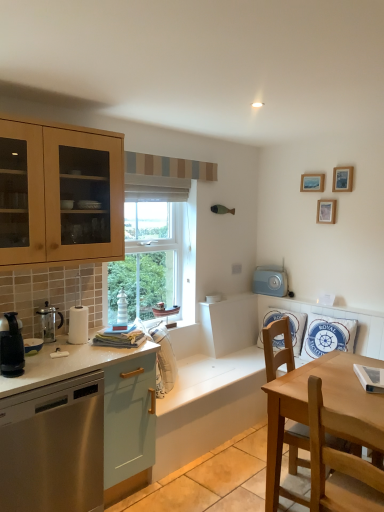
Question: Should I look upward or downward to see black plastic coffee maker at left, the 1th kitchen appliance from the front?

Choices:
 (A) up
 (B) down

Answer: (B)

Question: Which direction should I rotate to face white striped lighthouse at window, which is the third appliance in right-to-left order, — up or down?

Choices:
 (A) up
 (B) down

Answer: (B)

Question: Is wooden picture frame at upper right, the second picture frame ordered from the bottom, oriented towards white striped lighthouse at window, the second appliance when ordered from front to back?

Choices:
 (A) yes
 (B) no

Answer: (B)

Question: Can you confirm if wooden picture frame at upper right, the second picture frame ordered from the bottom, is thinner than white striped lighthouse at window, the second appliance when ordered from front to back?

Choices:
 (A) no
 (B) yes

Answer: (B)

Question: Is wooden picture frame at upper right, the second picture frame ordered from the bottom, to the right of white striped lighthouse at window, which is the third appliance in right-to-left order, from the viewer's perspective?

Choices:
 (A) yes
 (B) no

Answer: (A)

Question: From a real-world perspective, does wooden picture frame at upper right, placed as the 2th picture frame when sorted from top to bottom, sit lower than white striped lighthouse at window, which is the third appliance in right-to-left order?

Choices:
 (A) yes
 (B) no

Answer: (B)

Question: Is white striped lighthouse at window, which is counted as the 1th appliance, starting from the left, completely or partially inside wooden picture frame at upper right, placed as the 2th picture frame when sorted from top to bottom?

Choices:
 (A) yes
 (B) no

Answer: (B)

Question: Is wooden picture frame at upper right, placed as the 2th picture frame when sorted from top to bottom, with white striped lighthouse at window, the second appliance when ordered from front to back?

Choices:
 (A) yes
 (B) no

Answer: (B)

Question: Does white fabric pillow at right, acting as the second pillow starting from the right, contain transparent glass coffee maker at left, positioned as the 2th kitchen appliance in front-to-back order?

Choices:
 (A) no
 (B) yes

Answer: (A)

Question: Can you confirm if white fabric pillow at right, acting as the second pillow starting from the right, is positioned to the right of transparent glass coffee maker at left, arranged as the first kitchen appliance when viewed from the back?

Choices:
 (A) no
 (B) yes

Answer: (B)

Question: Can you confirm if white fabric pillow at right, acting as the second pillow starting from the right, is smaller than transparent glass coffee maker at left, arranged as the first kitchen appliance when viewed from the back?

Choices:
 (A) yes
 (B) no

Answer: (B)

Question: Considering the relative sizes of white fabric pillow at right, acting as the second pillow starting from the right, and transparent glass coffee maker at left, positioned as the 2th kitchen appliance in front-to-back order, in the image provided, is white fabric pillow at right, acting as the second pillow starting from the right, taller than transparent glass coffee maker at left, positioned as the 2th kitchen appliance in front-to-back order,?

Choices:
 (A) yes
 (B) no

Answer: (A)

Question: From the image's perspective, is white fabric pillow at right, which ranks as the 1th pillow in left-to-right order, located beneath transparent glass coffee maker at left, arranged as the first kitchen appliance when viewed from the back?

Choices:
 (A) no
 (B) yes

Answer: (B)

Question: Is white fabric pillow at right, acting as the second pillow starting from the right, oriented away from transparent glass coffee maker at left, positioned as the 2th kitchen appliance in front-to-back order?

Choices:
 (A) no
 (B) yes

Answer: (A)

Question: Considering the relative positions of stainless steel dishwasher at left and black plastic coffee maker at left, the 1th kitchen appliance from the front, in the image provided, is stainless steel dishwasher at left to the left of black plastic coffee maker at left, the 1th kitchen appliance from the front, from the viewer's perspective?

Choices:
 (A) no
 (B) yes

Answer: (A)